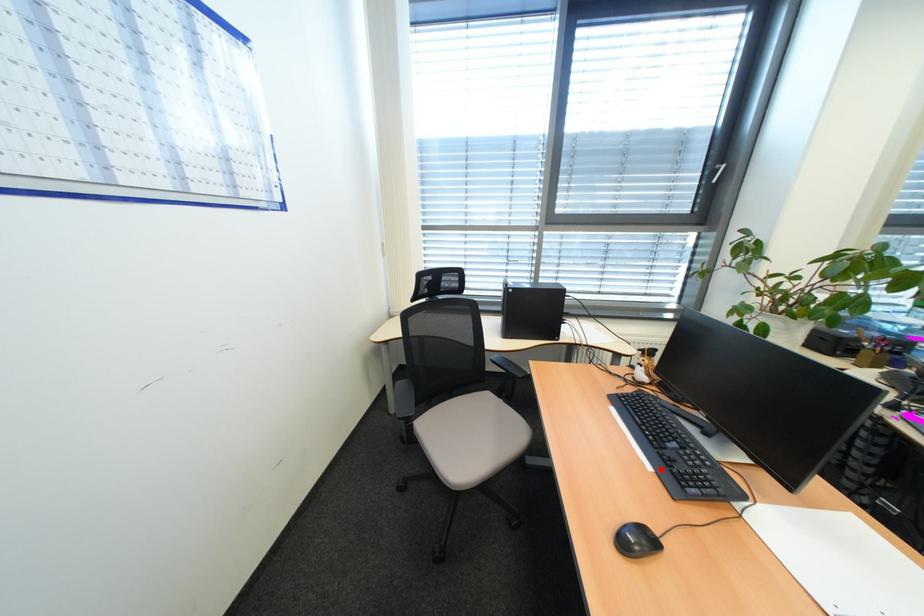
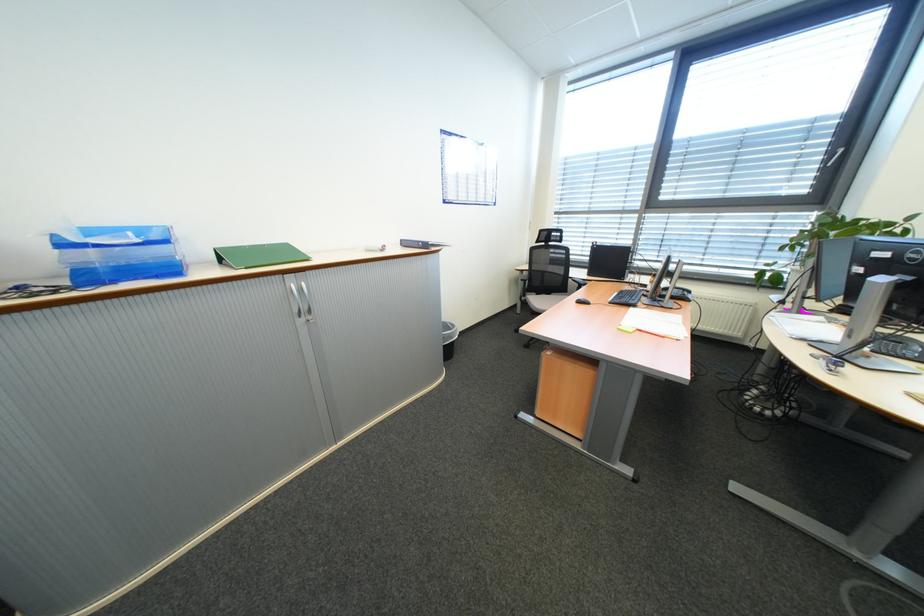
Where in the second image is the point corresponding to the highlighted location from the first image?

(619, 302)